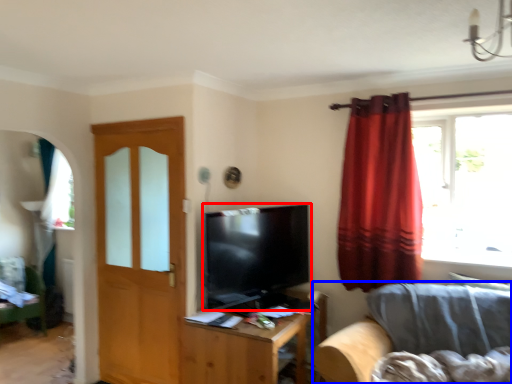
Question: Among these objects, which one is nearest to the camera, television (highlighted by a red box) or studio couch (highlighted by a blue box)?

Choices:
 (A) television
 (B) studio couch

Answer: (B)